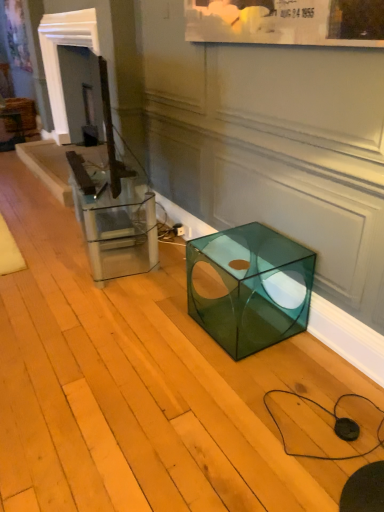
Question: Is white glossy fireplace at upper left inside the boundaries of clear glass cube at center, or outside?

Choices:
 (A) outside
 (B) inside

Answer: (A)

Question: From a real-world perspective, is white glossy fireplace at upper left physically located above or below clear glass cube at center?

Choices:
 (A) below
 (B) above

Answer: (B)

Question: Which of these objects is positioned closest to the transparent green cube at lower right?

Choices:
 (A) white glossy fireplace at upper left
 (B) clear glass cube at center

Answer: (B)

Question: Estimate the real-world distances between objects in this image. Which object is farther from the transparent green cube at lower right?

Choices:
 (A) clear glass cube at center
 (B) white glossy fireplace at upper left

Answer: (B)